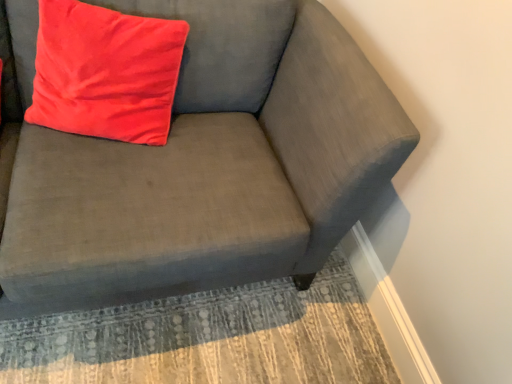
Image resolution: width=512 pixels, height=384 pixels. Describe the element at coordinates (208, 338) in the screenshot. I see `textured beige rug at lower center` at that location.

In order to face matte gray couch at upper right, should I rotate leftwards or rightwards?

It's best to rotate left around 12.984 degrees.

Where is `matte red pillow at upper left`? matte red pillow at upper left is located at coordinates (105, 72).

Identify the location of studio couch that appears above the textured beige rug at lower center (from the image's perspective). (205, 172).

From the image's perspective, is matte gray couch at upper right located beneath textured beige rug at lower center?

No.

Considering the sizes of objects matte gray couch at upper right and textured beige rug at lower center in the image provided, who is thinner, matte gray couch at upper right or textured beige rug at lower center?

matte gray couch at upper right.

Is matte red pillow at upper left shorter than matte gray couch at upper right?

Yes.

Which is farther, (70, 74) or (12, 32)?

Positioned behind is point (12, 32).

Who is smaller, matte red pillow at upper left or matte gray couch at upper right?

Smaller between the two is matte red pillow at upper left.

Choose the correct answer: Is matte red pillow at upper left inside matte gray couch at upper right or outside it?

matte red pillow at upper left fits inside matte gray couch at upper right.

In the image, is matte gray couch at upper right positioned in front of or behind matte red pillow at upper left?

matte gray couch at upper right is in front of matte red pillow at upper left.

In the scene shown: Are matte gray couch at upper right and matte red pillow at upper left located far from each other?

No, matte gray couch at upper right is in close proximity to matte red pillow at upper left.

Considering the relative sizes of matte gray couch at upper right and matte red pillow at upper left in the image provided, is matte gray couch at upper right wider than matte red pillow at upper left?

Yes, matte gray couch at upper right is wider than matte red pillow at upper left.

Is textured beige rug at lower center in front of or behind matte gray couch at upper right in the image?

textured beige rug at lower center is positioned farther from the viewer than matte gray couch at upper right.

Between point (276, 344) and point (49, 262), which one is positioned behind?

Positioned behind is point (276, 344).

From a real-world perspective, who is located lower, textured beige rug at lower center or matte gray couch at upper right?

textured beige rug at lower center is physically lower.

Looking at the image, does textured beige rug at lower center seem bigger or smaller compared to matte gray couch at upper right?

In the image, textured beige rug at lower center appears to be smaller than matte gray couch at upper right.

I want to click on mat behind the matte red pillow at upper left, so click(208, 338).

Which is in front, point (93, 46) or point (219, 343)?

Point (93, 46)

Measure the distance between matte red pillow at upper left and textured beige rug at lower center.

matte red pillow at upper left and textured beige rug at lower center are 28.49 inches apart.

Relative to textured beige rug at lower center, is matte red pillow at upper left in front or behind?

matte red pillow at upper left is positioned closer to the viewer than textured beige rug at lower center.

Is textured beige rug at lower center surrounding matte red pillow at upper left?

Actually, matte red pillow at upper left is outside textured beige rug at lower center.

How different are the orientations of textured beige rug at lower center and matte red pillow at upper left in degrees?

There is a 76.7-degree angle between the facing directions of textured beige rug at lower center and matte red pillow at upper left.

Locate an element on the screen. This screenshot has width=512, height=384. pillow that appears on the left of textured beige rug at lower center is located at coordinates (105, 72).

From a real-world perspective, is textured beige rug at lower center positioned over matte red pillow at upper left based on gravity?

Incorrect, from a real-world perspective, textured beige rug at lower center is lower than matte red pillow at upper left.

Image resolution: width=512 pixels, height=384 pixels. What are the coordinates of `mat behind the matte gray couch at upper right` in the screenshot? It's located at (208, 338).

Find the location of a particular element. The height and width of the screenshot is (384, 512). studio couch lying below the matte red pillow at upper left (from the image's perspective) is located at coordinates (205, 172).

Looking at the image, which one is located closer to matte red pillow at upper left, textured beige rug at lower center or matte gray couch at upper right?

matte gray couch at upper right.

From the image, which object appears to be nearer to textured beige rug at lower center, matte red pillow at upper left or matte gray couch at upper right?

matte gray couch at upper right.

From the image, which object appears to be farther from matte red pillow at upper left, matte gray couch at upper right or textured beige rug at lower center?

textured beige rug at lower center is further to matte red pillow at upper left.

Which object lies nearer to the anchor point matte gray couch at upper right, textured beige rug at lower center or matte red pillow at upper left?

matte red pillow at upper left is positioned closer to the anchor matte gray couch at upper right.

When comparing their distances from textured beige rug at lower center, does matte gray couch at upper right or matte red pillow at upper left seem further?

matte red pillow at upper left is positioned further to the anchor textured beige rug at lower center.

When comparing their distances from matte gray couch at upper right, does matte red pillow at upper left or textured beige rug at lower center seem further?

textured beige rug at lower center.

I want to click on studio couch between matte red pillow at upper left and textured beige rug at lower center in the up-down direction, so 205,172.